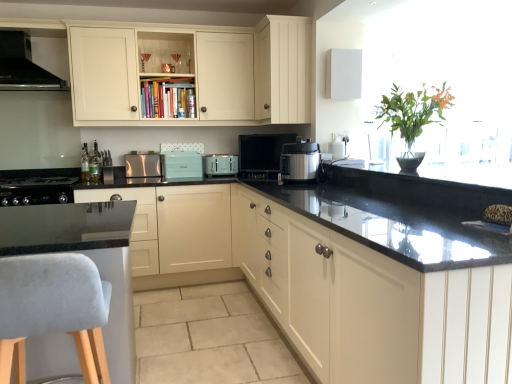
The image size is (512, 384). I want to click on metallic silver toaster at center, which is counted as the first appliance, starting from the right, so click(337, 149).

Image resolution: width=512 pixels, height=384 pixels. What do you see at coordinates (85, 164) in the screenshot?
I see `clear glass bottle at left, acting as the first bottle starting from the front` at bounding box center [85, 164].

Describe the element at coordinates (181, 165) in the screenshot. The height and width of the screenshot is (384, 512). I see `teal matte toaster at center, which is counted as the 2th appliance, starting from the right` at that location.

Locate an element on the screen. The width and height of the screenshot is (512, 384). black matte range hood at upper left, which ranks as the fourth kitchen appliance in bottom-to-top order is located at coordinates (23, 65).

What is the approximate height of satin silver toaster at center, marked as the third kitchen appliance in a bottom-to-top arrangement?

The height of satin silver toaster at center, marked as the third kitchen appliance in a bottom-to-top arrangement, is 9.25 inches.

Where is `metallic silver toaster at center, acting as the third appliance starting from the left`? This screenshot has width=512, height=384. metallic silver toaster at center, acting as the third appliance starting from the left is located at coordinates (337, 149).

From the image's perspective, which is below, metallic silver toaster at center, acting as the third appliance starting from the left, or satin silver pressure cooker at center, placed as the first kitchen appliance when sorted from bottom to top?

satin silver pressure cooker at center, placed as the first kitchen appliance when sorted from bottom to top, from the image's perspective.

Is metallic silver toaster at center, acting as the third appliance starting from the left, surrounding satin silver pressure cooker at center, which is counted as the 4th kitchen appliance, starting from the left?

No, satin silver pressure cooker at center, which is counted as the 4th kitchen appliance, starting from the left, is not a part of metallic silver toaster at center, acting as the third appliance starting from the left.

Between point (330, 146) and point (305, 174), which one is positioned behind?

Point (330, 146)

Is metallic silver toaster at center, which is counted as the first appliance, starting from the right, to the left or to the right of satin silver pressure cooker at center, arranged as the 1th kitchen appliance when viewed from the right, in the image?

In the image, metallic silver toaster at center, which is counted as the first appliance, starting from the right, appears on the right side of satin silver pressure cooker at center, arranged as the 1th kitchen appliance when viewed from the right.

Is teal matte toaster at center, marked as the 2th kitchen appliance in a bottom-to-top arrangement, positioned with its back to black matte range hood at upper left, placed as the 4th kitchen appliance when sorted from right to left?

No, black matte range hood at upper left, placed as the 4th kitchen appliance when sorted from right to left, is not at the back of teal matte toaster at center, marked as the 2th kitchen appliance in a bottom-to-top arrangement.

Considering the relative sizes of teal matte toaster at center, the 3th kitchen appliance positioned from the left, and black matte range hood at upper left, which is counted as the first kitchen appliance, starting from the top, in the image provided, is teal matte toaster at center, the 3th kitchen appliance positioned from the left, taller than black matte range hood at upper left, which is counted as the first kitchen appliance, starting from the top,?

Incorrect, the height of teal matte toaster at center, the 3th kitchen appliance positioned from the left, is not larger of that of black matte range hood at upper left, which is counted as the first kitchen appliance, starting from the top.

Is teal matte toaster at center, marked as the 2th kitchen appliance in a bottom-to-top arrangement, beside black matte range hood at upper left, which ranks as the fourth kitchen appliance in bottom-to-top order?

teal matte toaster at center, marked as the 2th kitchen appliance in a bottom-to-top arrangement, and black matte range hood at upper left, which ranks as the fourth kitchen appliance in bottom-to-top order, are clearly separated.

Based on the photo, relative to matte cream cabinet at upper center, which is the second cabinetry in top-to-bottom order, is satin silver coffee machine at center in front or behind?

Clearly, satin silver coffee machine at center is behind matte cream cabinet at upper center, which is the second cabinetry in top-to-bottom order.

Which of these two, satin silver coffee machine at center or matte cream cabinet at upper center, the 2th cabinetry in the bottom-to-top sequence, is bigger?

matte cream cabinet at upper center, the 2th cabinetry in the bottom-to-top sequence.

Is satin silver coffee machine at center with matte cream cabinet at upper center, which is the second cabinetry in top-to-bottom order?

satin silver coffee machine at center and matte cream cabinet at upper center, which is the second cabinetry in top-to-bottom order, are not in contact.

Considering the relative positions of satin silver coffee machine at center and matte cream cabinet at upper center, which is the second cabinetry in top-to-bottom order, in the image provided, is satin silver coffee machine at center to the left or to the right of matte cream cabinet at upper center, which is the second cabinetry in top-to-bottom order,?

From the image, it's evident that satin silver coffee machine at center is to the left of matte cream cabinet at upper center, which is the second cabinetry in top-to-bottom order.

Is satin black stove at lower left, which is the 3th appliance from right to left, taller or shorter than clear glass bottle at left, marked as the 2th bottle in a back-to-front arrangement?

Considering their sizes, satin black stove at lower left, which is the 3th appliance from right to left, has less height than clear glass bottle at left, marked as the 2th bottle in a back-to-front arrangement.

Does satin black stove at lower left, which is counted as the first appliance, starting from the left, have a smaller size compared to clear glass bottle at left, marked as the 2th bottle in a back-to-front arrangement?

Actually, satin black stove at lower left, which is counted as the first appliance, starting from the left, might be larger than clear glass bottle at left, marked as the 2th bottle in a back-to-front arrangement.

From the image's perspective, between satin black stove at lower left, which is counted as the first appliance, starting from the left, and clear glass bottle at left, acting as the first bottle starting from the front, who is located below?

satin black stove at lower left, which is counted as the first appliance, starting from the left, appears lower in the image.

Is satin black stove at lower left, which is counted as the first appliance, starting from the left, positioned with its back to clear glass bottle at left, acting as the first bottle starting from the front?

satin black stove at lower left, which is counted as the first appliance, starting from the left, does not have its back to clear glass bottle at left, acting as the first bottle starting from the front.

Considering the positions of objects satin silver toaster at center, which ranks as the second kitchen appliance in left-to-right order, and cream matte cabinet at upper center, placed as the 1th cabinetry when sorted from top to bottom, in the image provided, who is behind, satin silver toaster at center, which ranks as the second kitchen appliance in left-to-right order, or cream matte cabinet at upper center, placed as the 1th cabinetry when sorted from top to bottom,?

Positioned behind is satin silver toaster at center, which ranks as the second kitchen appliance in left-to-right order.

From a real-world perspective, is satin silver toaster at center, marked as the third kitchen appliance in a bottom-to-top arrangement, above or below cream matte cabinet at upper center, placed as the 1th cabinetry when sorted from top to bottom?

In terms of real-world spatial position, satin silver toaster at center, marked as the third kitchen appliance in a bottom-to-top arrangement, is below cream matte cabinet at upper center, placed as the 1th cabinetry when sorted from top to bottom.

Locate an element on the screen. the 1st kitchen appliance counting from the left of the cream matte cabinet at upper center, the third cabinetry when ordered from bottom to top is located at coordinates (142, 165).

Which of these two, satin silver toaster at center, which is counted as the second kitchen appliance, starting from the top, or cream matte cabinet at upper center, the third cabinetry when ordered from bottom to top, is smaller?

satin silver toaster at center, which is counted as the second kitchen appliance, starting from the top, is smaller.

Which is less distant, (x=98, y=158) or (x=166, y=165)?

Positioned in front is point (x=98, y=158).

In the scene shown: Is green glass bottle at left, the 1th bottle positioned from the back, situated inside teal matte toaster at center, which is counted as the 2th appliance, starting from the right, or outside?

green glass bottle at left, the 1th bottle positioned from the back, lies outside teal matte toaster at center, which is counted as the 2th appliance, starting from the right.

Is green glass bottle at left, which ranks as the second bottle in front-to-back order, positioned behind teal matte toaster at center, which is counted as the 2th appliance, starting from the right?

No, the depth of green glass bottle at left, which ranks as the second bottle in front-to-back order, is less than that of teal matte toaster at center, which is counted as the 2th appliance, starting from the right.

From the image's perspective, which object appears higher, green glass bottle at left, the 1th bottle positioned from the back, or teal matte toaster at center, which ranks as the 2th appliance in left-to-right order?

From the image's view, teal matte toaster at center, which ranks as the 2th appliance in left-to-right order, is above.

Is clear glass bottle at left, acting as the first bottle starting from the front, far from satin silver pressure cooker at center, arranged as the 1th kitchen appliance when viewed from the right?

That's right, there is a large distance between clear glass bottle at left, acting as the first bottle starting from the front, and satin silver pressure cooker at center, arranged as the 1th kitchen appliance when viewed from the right.

From a real-world perspective, is clear glass bottle at left, acting as the first bottle starting from the front, below satin silver pressure cooker at center, arranged as the 1th kitchen appliance when viewed from the right?

Indeed, from a real-world perspective, clear glass bottle at left, acting as the first bottle starting from the front, is positioned beneath satin silver pressure cooker at center, arranged as the 1th kitchen appliance when viewed from the right.

Which of these two, clear glass bottle at left, acting as the first bottle starting from the front, or satin silver pressure cooker at center, placed as the first kitchen appliance when sorted from bottom to top, stands shorter?

clear glass bottle at left, acting as the first bottle starting from the front, is shorter.

Identify the location of the 2nd kitchen appliance in front of the metallic silver toaster at center, acting as the third appliance starting from the left. The height and width of the screenshot is (384, 512). tap(300, 161).

In order to click on the 2nd kitchen appliance above the teal matte toaster at center, placed as the 3th kitchen appliance when sorted from top to bottom (from the image's perspective) in this screenshot , I will do (23, 65).

When comparing their distances from metallic silver toaster at center, which is counted as the first appliance, starting from the right, does teal matte toaster at center, which is counted as the 2th appliance, starting from the right, or matte cream cabinets at center, which is the 3th cabinetry in top-to-bottom order, seem closer?

teal matte toaster at center, which is counted as the 2th appliance, starting from the right, is closer to metallic silver toaster at center, which is counted as the first appliance, starting from the right.

Based on the photo, based on their spatial positions, is green glass bottle at left, the 1th bottle positioned from the back, or black granite countertop at lower left, which is the first countertop from front to back, closer to teal matte toaster at center, which ranks as the 2th appliance in left-to-right order?

Based on the image, green glass bottle at left, the 1th bottle positioned from the back, appears to be nearer to teal matte toaster at center, which ranks as the 2th appliance in left-to-right order.

From the image, which object appears to be nearer to satin black stove at lower left, which is counted as the first appliance, starting from the left, green glass bottle at left, the 1th bottle positioned from the back, or black matte range hood at upper left, which ranks as the fourth kitchen appliance in bottom-to-top order?

The object closer to satin black stove at lower left, which is counted as the first appliance, starting from the left, is green glass bottle at left, the 1th bottle positioned from the back.

From the image, which object appears to be farther from teal matte toaster at center, placed as the 3th kitchen appliance when sorted from top to bottom, smooth black countertop at lower left, positioned as the 1th countertop in back-to-front order, or satin black stove at lower left, which is the 3th appliance from right to left?

satin black stove at lower left, which is the 3th appliance from right to left, is further to teal matte toaster at center, placed as the 3th kitchen appliance when sorted from top to bottom.

When comparing their distances from black granite countertop at lower left, marked as the second countertop in a back-to-front arrangement, does black matte range hood at upper left, which appears as the first kitchen appliance when viewed from the left, or green glass bottle at left, which ranks as the second bottle in front-to-back order, seem further?

Based on the image, black matte range hood at upper left, which appears as the first kitchen appliance when viewed from the left, appears to be further to black granite countertop at lower left, marked as the second countertop in a back-to-front arrangement.

From the image, which object appears to be nearer to satin silver toaster at center, which ranks as the second kitchen appliance in left-to-right order, metallic silver toaster at center, acting as the third appliance starting from the left, or teal matte toaster at center, which is counted as the 2th appliance, starting from the right?

teal matte toaster at center, which is counted as the 2th appliance, starting from the right, is closer to satin silver toaster at center, which ranks as the second kitchen appliance in left-to-right order.

Which object lies further to the anchor point black granite countertop at lower left, marked as the second countertop in a back-to-front arrangement, satin silver pressure cooker at center, arranged as the 1th kitchen appliance when viewed from the right, or satin black stove at lower left, which is the 3th appliance from right to left?

Among the two, satin black stove at lower left, which is the 3th appliance from right to left, is located further to black granite countertop at lower left, marked as the second countertop in a back-to-front arrangement.

Considering their positions, is clear glass bottle at left, acting as the first bottle starting from the front, positioned closer to teal matte toaster at center, the 3th kitchen appliance positioned from the left, than smooth black countertop at lower left, positioned as the 1th countertop in back-to-front order?

smooth black countertop at lower left, positioned as the 1th countertop in back-to-front order, is closer to teal matte toaster at center, the 3th kitchen appliance positioned from the left.

You are a GUI agent. You are given a task and a screenshot of the screen. Output one action in this format:
    pyautogui.click(x=<x>, y=<y>)
    Task: Click on the kitchen appliance between cream matte cabinet at upper center, placed as the 1th cabinetry when sorted from top to bottom, and teal matte toaster at center, the 3th kitchen appliance positioned from the left, in the vertical direction
    The image size is (512, 384).
    Given the screenshot: What is the action you would take?
    pyautogui.click(x=142, y=165)

At what (x,y) coordinates should I click in order to perform the action: click on kitchen appliance situated between clear glass bottle at left, marked as the 2th bottle in a back-to-front arrangement, and teal matte toaster at center, the 3th kitchen appliance positioned from the left, from left to right. Please return your answer as a coordinate pair (x, y). The width and height of the screenshot is (512, 384). Looking at the image, I should click on (142, 165).

Identify the location of countertop between black granite countertop at lower left, marked as the second countertop in a back-to-front arrangement, and satin silver pressure cooker at center, placed as the first kitchen appliance when sorted from bottom to top, from front to back. (88, 256).

You are a GUI agent. You are given a task and a screenshot of the screen. Output one action in this format:
    pyautogui.click(x=<x>, y=<y>)
    Task: Click on the appliance between satin silver toaster at center, which is counted as the second kitchen appliance, starting from the top, and satin silver coffee machine at center
    This screenshot has height=384, width=512.
    Given the screenshot: What is the action you would take?
    pyautogui.click(x=181, y=165)